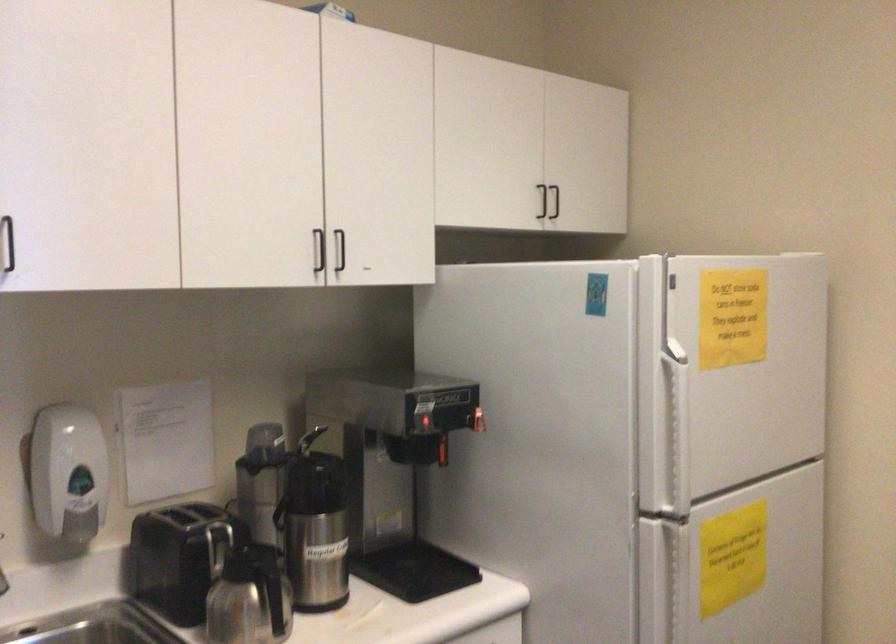
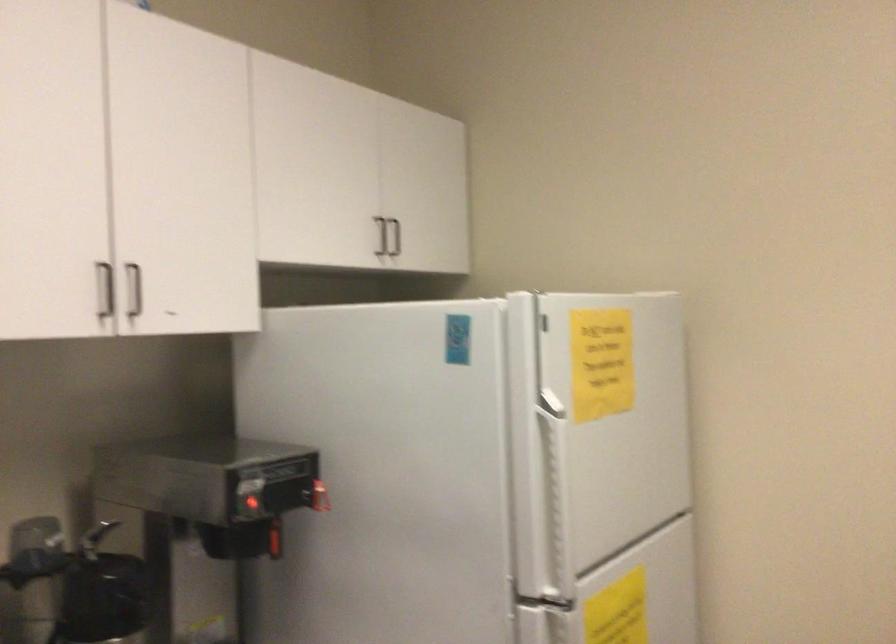
In the second image, find the point that corresponds to pixel 728 317 in the first image.

(600, 363)